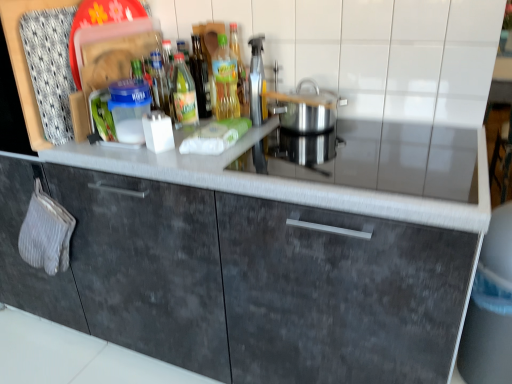
Question: Considering the relative sizes of smooth gray countertop at center and dark gray matte cabinet at center in the image provided, is smooth gray countertop at center thinner than dark gray matte cabinet at center?

Choices:
 (A) yes
 (B) no

Answer: (A)

Question: Considering the relative sizes of smooth gray countertop at center and dark gray matte cabinet at center in the image provided, is smooth gray countertop at center smaller than dark gray matte cabinet at center?

Choices:
 (A) no
 (B) yes

Answer: (B)

Question: Considering the relative sizes of smooth gray countertop at center and dark gray matte cabinet at center in the image provided, is smooth gray countertop at center bigger than dark gray matte cabinet at center?

Choices:
 (A) yes
 (B) no

Answer: (B)

Question: From a real-world perspective, is smooth gray countertop at center physically below dark gray matte cabinet at center?

Choices:
 (A) yes
 (B) no

Answer: (B)

Question: Does smooth gray countertop at center have a greater width compared to dark gray matte cabinet at center?

Choices:
 (A) yes
 (B) no

Answer: (B)

Question: Is smooth gray countertop at center closer to the viewer compared to dark gray matte cabinet at center?

Choices:
 (A) yes
 (B) no

Answer: (B)

Question: Considering the relative sizes of translucent plastic bottle at center, the 1th bottle when ordered from right to left, and smooth gray countertop at center in the image provided, is translucent plastic bottle at center, the 1th bottle when ordered from right to left, bigger than smooth gray countertop at center?

Choices:
 (A) yes
 (B) no

Answer: (B)

Question: Is translucent plastic bottle at center, the second bottle when ordered from left to right, directly adjacent to smooth gray countertop at center?

Choices:
 (A) yes
 (B) no

Answer: (B)

Question: Does translucent plastic bottle at center, the second bottle when ordered from left to right, have a greater width compared to smooth gray countertop at center?

Choices:
 (A) yes
 (B) no

Answer: (B)

Question: Does translucent plastic bottle at center, the second bottle when ordered from left to right, turn towards smooth gray countertop at center?

Choices:
 (A) no
 (B) yes

Answer: (A)

Question: Considering the relative positions of translucent plastic bottle at center, the second bottle when ordered from left to right, and smooth gray countertop at center in the image provided, is translucent plastic bottle at center, the second bottle when ordered from left to right, to the right of smooth gray countertop at center from the viewer's perspective?

Choices:
 (A) yes
 (B) no

Answer: (B)

Question: Could smooth gray countertop at center be considered to be inside translucent plastic bottle at center, the second bottle when ordered from left to right?

Choices:
 (A) no
 (B) yes

Answer: (A)

Question: From the image's perspective, is smooth gray countertop at center on silver metallic pot at center?

Choices:
 (A) yes
 (B) no

Answer: (B)